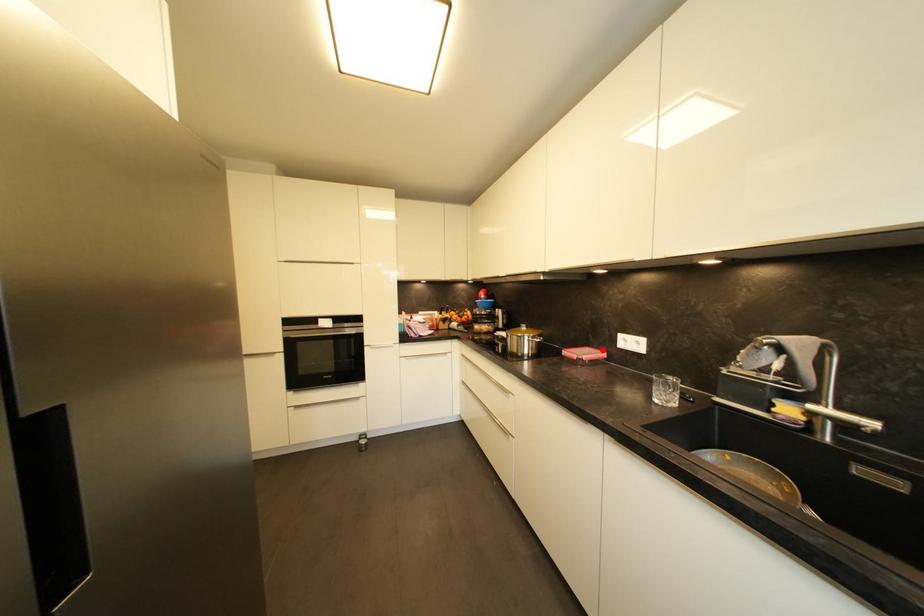
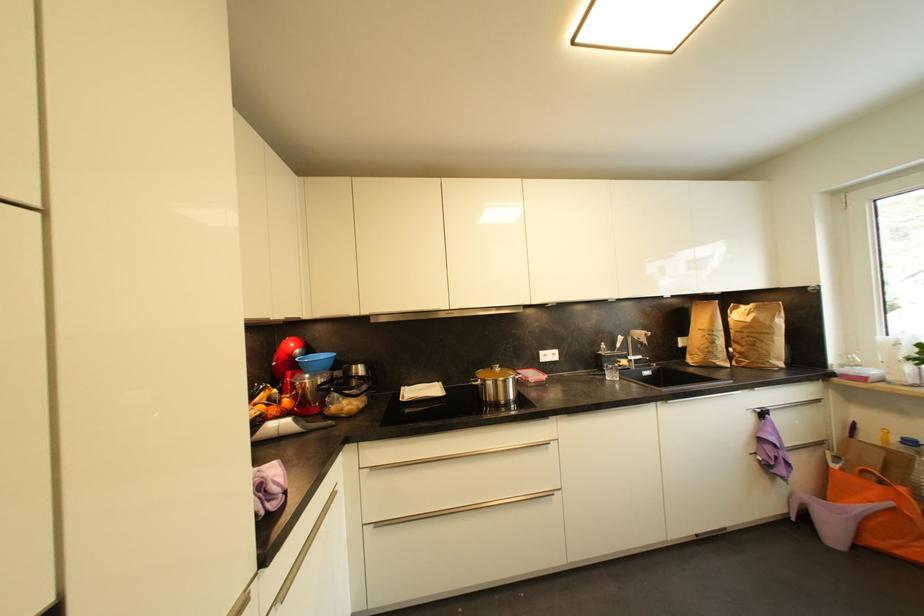
Question: I am providing you with two images of the same scene from different viewpoints. A red point is shown in image1. For the corresponding object point in image2, is it positioned nearer or farther from the camera?

Choices:
 (A) Nearer
 (B) Farther

Answer: (B)